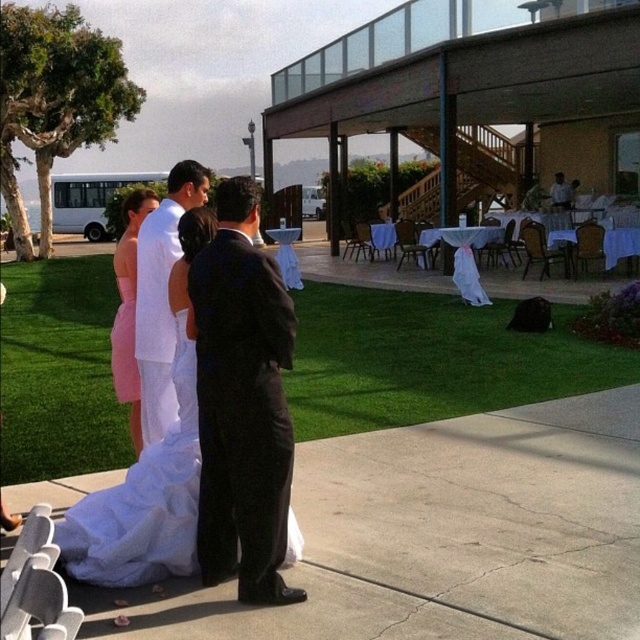
Does black satin suit at center have a smaller size compared to white matte suit at center?

Incorrect, black satin suit at center is not smaller in size than white matte suit at center.

Is black satin suit at center behind white matte suit at center?

No, black satin suit at center is in front of white matte suit at center.

The width and height of the screenshot is (640, 640). Describe the element at coordinates (243, 403) in the screenshot. I see `black satin suit at center` at that location.

Locate an element on the screen. The width and height of the screenshot is (640, 640). black satin suit at center is located at coordinates (243, 403).

Is the position of white satin dress at center less distant than that of pink satin dress at center?

Yes, white satin dress at center is closer to the viewer.

Does white satin dress at center have a lesser height compared to pink satin dress at center?

Yes.

Is point (188, 323) farther from viewer compared to point (141, 188)?

No, (188, 323) is in front of (141, 188).

Where is `white satin dress at center`? white satin dress at center is located at coordinates (150, 433).

Which is above, white satin dress at center or white matte suit at center?

white matte suit at center is higher up.

Is point (195, 365) closer to viewer compared to point (156, 248)?

Yes, it is.

Is point (147, 376) positioned before point (154, 380)?

No, it is behind (154, 380).

Find the location of a particular element. This screenshot has width=640, height=640. white satin dress at center is located at coordinates (150, 433).